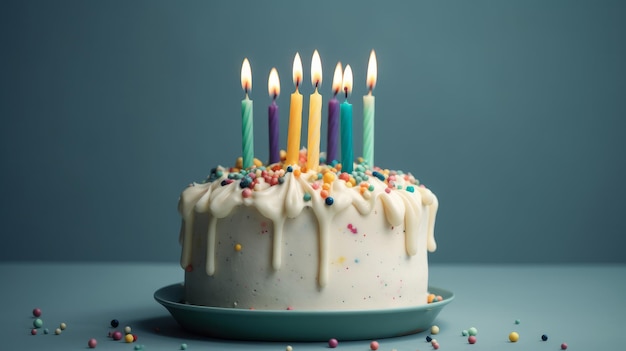
You are a GUI agent. You are given a task and a screenshot of the screen. Output one action in this format:
    pyautogui.click(x=<x>, y=<y>)
    Task: Click on the cake candles
    
    Given the screenshot: What is the action you would take?
    pyautogui.click(x=247, y=124), pyautogui.click(x=274, y=116), pyautogui.click(x=290, y=116), pyautogui.click(x=313, y=118), pyautogui.click(x=334, y=125), pyautogui.click(x=351, y=126), pyautogui.click(x=370, y=126)